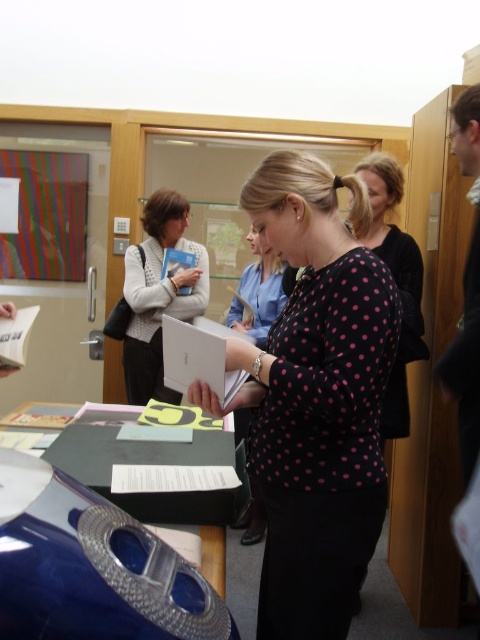
Between white knitted sweater at center and multicolored striped paper at left, which one is positioned lower?

white knitted sweater at center is lower down.

Can you confirm if white knitted sweater at center is wider than multicolored striped paper at left?

In fact, white knitted sweater at center might be narrower than multicolored striped paper at left.

Between point (159, 237) and point (52, 186), which one is positioned in front?

Positioned in front is point (159, 237).

Locate an element on the screen. The height and width of the screenshot is (640, 480). white knitted sweater at center is located at coordinates (158, 294).

Which is more to the left, white knitted sweater at center or shiny blue table at center?

From the viewer's perspective, shiny blue table at center appears more on the left side.

Between white knitted sweater at center and shiny blue table at center, which one has more height?

white knitted sweater at center

Is point (144, 330) closer to camera compared to point (218, 579)?

That is False.

You are a GUI agent. You are given a task and a screenshot of the screen. Output one action in this format:
    pyautogui.click(x=<x>, y=<y>)
    Task: Click on the white knitted sweater at center
    
    Given the screenshot: What is the action you would take?
    pyautogui.click(x=158, y=294)

Is black dotted shirt at center positioned in front of multicolored striped paper at left?

That is True.

Does black dotted shirt at center appear over multicolored striped paper at left?

Incorrect, black dotted shirt at center is not positioned above multicolored striped paper at left.

Does point (264, 401) come closer to viewer compared to point (39, 160)?

Yes.

Find the location of `black dotted shirt at center`. black dotted shirt at center is located at coordinates (314, 397).